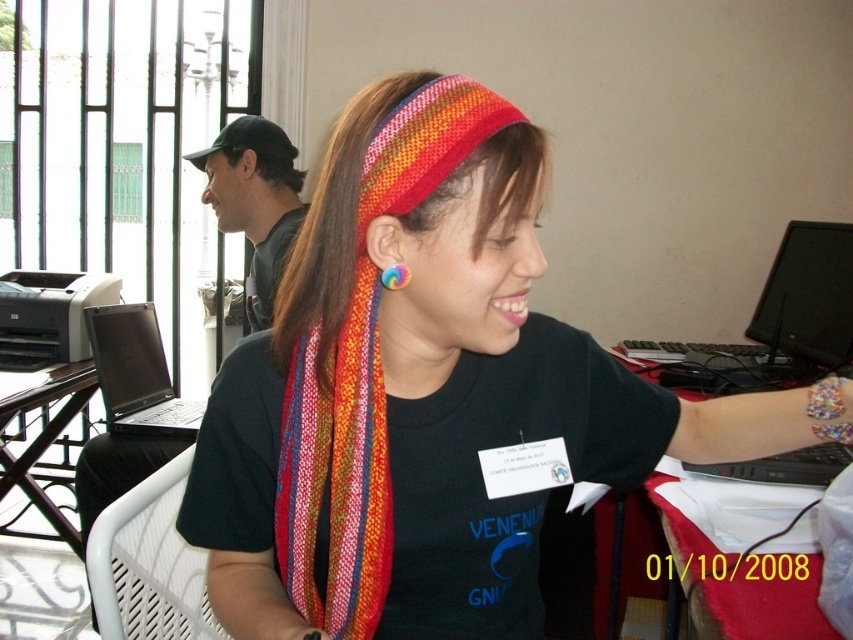
Question: Can you confirm if metallic silver table at lower left is thinner than rainbow fabric earring at ear?

Choices:
 (A) no
 (B) yes

Answer: (A)

Question: Is knitted fabric headband at center in front of black plastic laptop at lower right?

Choices:
 (A) yes
 (B) no

Answer: (A)

Question: Which point appears farthest from the camera in this image?

Choices:
 (A) [x=601, y=589]
 (B) [x=366, y=566]
 (C) [x=317, y=342]

Answer: (A)

Question: Estimate the real-world distances between objects in this image. Which object is farther from the black glossy laptop at left?

Choices:
 (A) red cloth at right
 (B) knitted fabric headband at center
 (C) black plastic laptop at lower right
 (D) knitted fabric scarf at center

Answer: (D)

Question: Does black glossy laptop at left have a lesser width compared to metallic silver table at lower left?

Choices:
 (A) no
 (B) yes

Answer: (B)

Question: Which object is positioned closest to the black plastic laptop at lower right?

Choices:
 (A) brown matte hair at upper left
 (B) metallic silver table at lower left
 (C) black glossy laptop at left

Answer: (A)